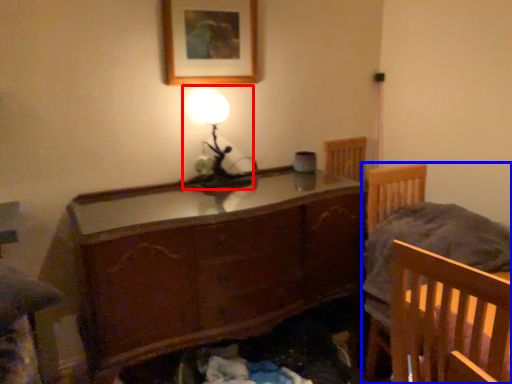
Question: Which point is further to the camera, table lamp (highlighted by a red box) or furniture (highlighted by a blue box)?

Choices:
 (A) table lamp
 (B) furniture

Answer: (A)